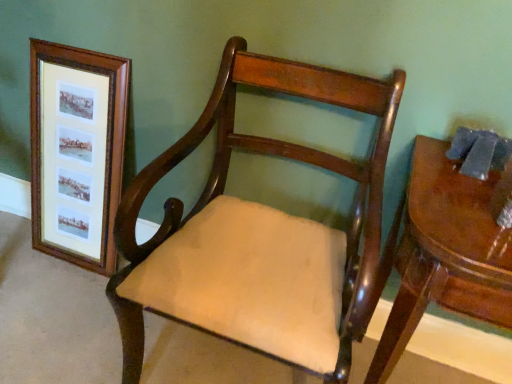
Question: Should I look upward or downward to see glossy wood table at right?

Choices:
 (A) up
 (B) down

Answer: (B)

Question: From the image's perspective, is glossy wood table at right below wooden frame at left?

Choices:
 (A) no
 (B) yes

Answer: (B)

Question: Does glossy wood table at right turn towards wooden frame at left?

Choices:
 (A) yes
 (B) no

Answer: (B)

Question: Is glossy wood table at right positioned far away from wooden frame at left?

Choices:
 (A) no
 (B) yes

Answer: (A)

Question: Is glossy wood table at right at the left side of wooden frame at left?

Choices:
 (A) yes
 (B) no

Answer: (B)

Question: Is wooden frame at left at the back of glossy wood table at right?

Choices:
 (A) yes
 (B) no

Answer: (B)

Question: Can you confirm if glossy wood table at right is shorter than wooden frame at left?

Choices:
 (A) no
 (B) yes

Answer: (B)

Question: Is wooden frame at left positioned far away from glossy wood table at right?

Choices:
 (A) no
 (B) yes

Answer: (A)

Question: From a real-world perspective, is wooden frame at left positioned under glossy wood table at right based on gravity?

Choices:
 (A) yes
 (B) no

Answer: (B)

Question: Does wooden frame at left have a greater width compared to glossy wood table at right?

Choices:
 (A) yes
 (B) no

Answer: (B)

Question: Does wooden frame at left have a larger size compared to glossy wood table at right?

Choices:
 (A) no
 (B) yes

Answer: (A)

Question: Does wooden frame at left lie in front of glossy wood table at right?

Choices:
 (A) yes
 (B) no

Answer: (B)

Question: Would you say wooden frame at left is outside glossy wood table at right?

Choices:
 (A) yes
 (B) no

Answer: (A)

Question: Is mahogany wood chair at center positioned far away from wooden frame at left?

Choices:
 (A) no
 (B) yes

Answer: (A)